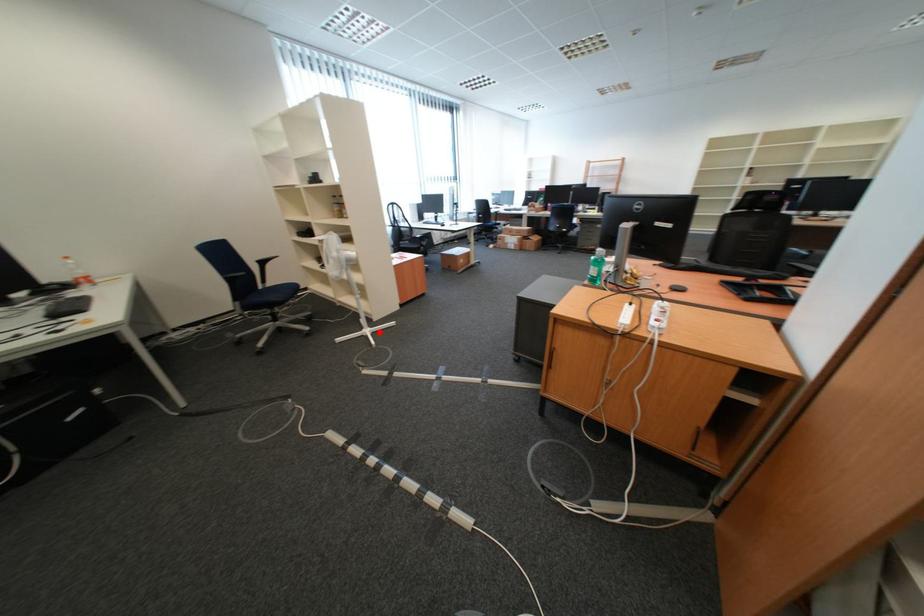
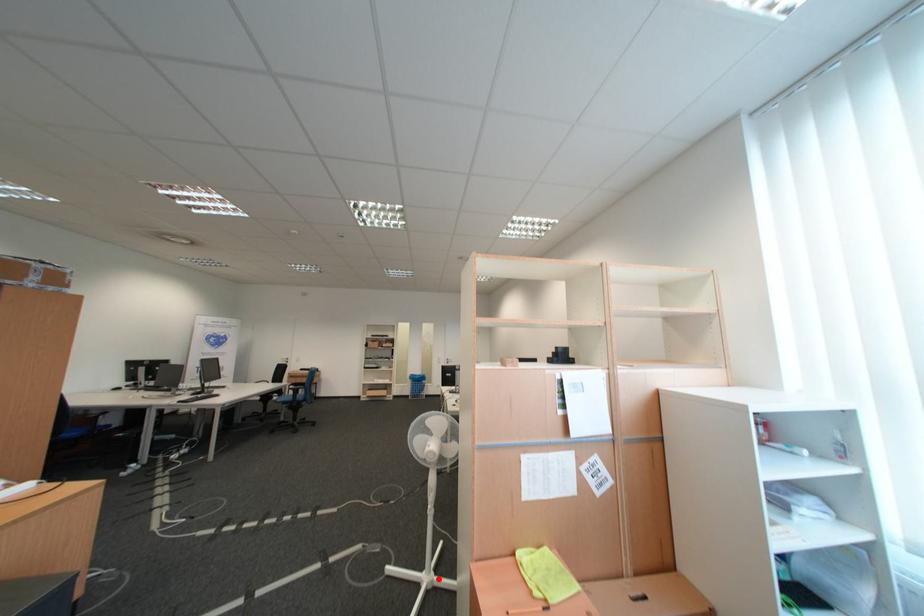
I am providing you with two images of the same scene from different viewpoints. A red point is marked on the first image and another point is marked on the second image. Is the marked point in image1 the same physical position as the marked point in image2?

Yes